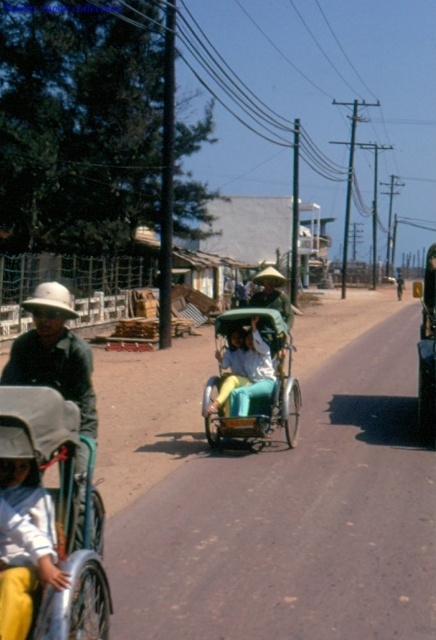
Question: Which point appears closest to the camera in this image?

Choices:
 (A) (227, 419)
 (B) (19, 508)
 (C) (85, 408)

Answer: (B)

Question: Does matte white coach at left lie in front of light blue fabric at lower left?

Choices:
 (A) no
 (B) yes

Answer: (A)

Question: Can you confirm if green fabric rickshaw at center is positioned above matte white coach at left?

Choices:
 (A) no
 (B) yes

Answer: (B)

Question: Which point is closer to the camera taking this photo?

Choices:
 (A) (61, 356)
 (B) (252, 436)
 (C) (23, 566)

Answer: (C)

Question: Does green fabric rickshaw at center appear under light blue fabric at lower left?

Choices:
 (A) yes
 (B) no

Answer: (B)

Question: Estimate the real-world distances between objects in this image. Which object is closer to the matte white coach at left?

Choices:
 (A) light blue fabric at lower left
 (B) green fabric rickshaw at center

Answer: (A)